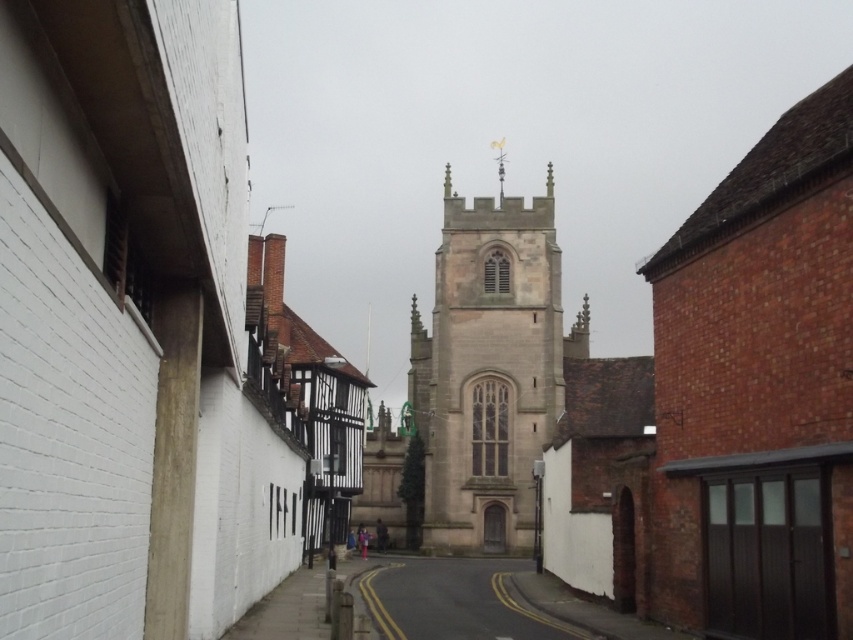
You are standing at the point marked as point (486, 371) in the image. What structure are you directly facing?

The light brown stone tower at center is located at point (486, 371), so you are directly facing the light brown stone tower at center.

You are driving a delivery van that is 3 meters tall. You need to pass under the light brown stone tower at center to reach the church. Is there enough clearance for your van above the smooth asphalt road at center?

The light brown stone tower at center is above the smooth asphalt road at center, so the clearance under the tower is sufficient for a 3 meter tall van to pass safely.